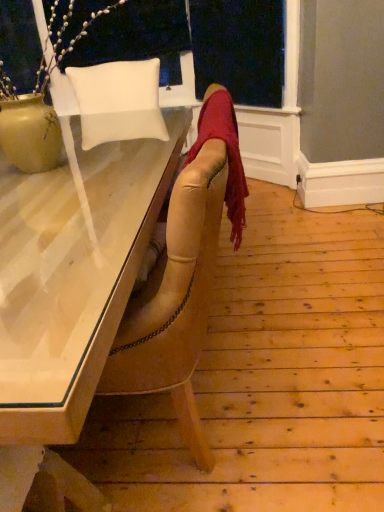
What is the approximate width of transparent glass window screen at upper center?

The width of transparent glass window screen at upper center is 4.73 inches.

At what (x,y) coordinates should I click in order to perform the action: click on white leather pillow at upper left. Please return your answer as a coordinate pair (x, y). The image size is (384, 512). Looking at the image, I should click on (118, 101).

The height and width of the screenshot is (512, 384). What do you see at coordinates (38, 105) in the screenshot?
I see `matte ceramic vase at upper left` at bounding box center [38, 105].

Where is `velvet red scarf at center`? The width and height of the screenshot is (384, 512). velvet red scarf at center is located at coordinates (227, 154).

Is matte ceramic vase at upper left touching velvet red scarf at center?

No, matte ceramic vase at upper left is not in contact with velvet red scarf at center.

The width and height of the screenshot is (384, 512). What are the coordinates of `blanket behind the matte ceramic vase at upper left` in the screenshot? It's located at (227, 154).

How far apart are matte ceramic vase at upper left and velvet red scarf at center?

matte ceramic vase at upper left and velvet red scarf at center are 73.46 centimeters apart.

Does matte ceramic vase at upper left turn towards velvet red scarf at center?

No, matte ceramic vase at upper left is not turned towards velvet red scarf at center.

Is point (30, 319) positioned behind point (216, 53)?

No, (30, 319) is closer to viewer.

Is matte white desk at center wider or thinner than transparent glass window screen at upper center?

Clearly, matte white desk at center has more width compared to transparent glass window screen at upper center.

Is matte white desk at center positioned far away from transparent glass window screen at upper center?

Yes, matte white desk at center and transparent glass window screen at upper center are quite far apart.

From a real-world perspective, who is located higher, matte white desk at center or transparent glass window screen at upper center?

In real-world perspective, transparent glass window screen at upper center is above.

Consider the image. How different are the orientations of matte white desk at center and velvet red scarf at center in degrees?

91.8 degrees.

Which of these two, matte white desk at center or velvet red scarf at center, stands taller?

matte white desk at center.

From the image's perspective, is matte white desk at center located above velvet red scarf at center?

No, from the image's perspective, matte white desk at center is not above velvet red scarf at center.

Does matte white desk at center have a lesser width compared to velvet red scarf at center?

No.

Based on the photo, from the image's perspective, relative to white leather pillow at upper left, is matte white desk at center above or below?

matte white desk at center is situated lower than white leather pillow at upper left in the image.

Is matte white desk at center outside of white leather pillow at upper left?

That's correct, matte white desk at center is outside of white leather pillow at upper left.

Considering the positions of objects matte white desk at center and white leather pillow at upper left in the image provided, who is behind, matte white desk at center or white leather pillow at upper left?

white leather pillow at upper left is further away from the camera.

Considering the sizes of objects matte ceramic vase at upper left and white leather pillow at upper left in the image provided, who is wider, matte ceramic vase at upper left or white leather pillow at upper left?

matte ceramic vase at upper left.

Is white leather pillow at upper left at the back of matte ceramic vase at upper left?

Correct, matte ceramic vase at upper left is looking away from white leather pillow at upper left.

Which is more to the right, matte ceramic vase at upper left or white leather pillow at upper left?

white leather pillow at upper left.

From a real-world perspective, between matte ceramic vase at upper left and white leather pillow at upper left, who is vertically higher?

matte ceramic vase at upper left.

Which object is further away from the camera, white leather pillow at upper left or transparent glass window screen at upper center?

Positioned behind is transparent glass window screen at upper center.

This screenshot has height=512, width=384. Identify the location of window screen above the white leather pillow at upper left (from a real-world perspective). (239, 49).

Can you confirm if white leather pillow at upper left is positioned to the right of transparent glass window screen at upper center?

Incorrect, white leather pillow at upper left is not on the right side of transparent glass window screen at upper center.

From a real-world perspective, is velvet red scarf at center physically located above or below matte white desk at center?

velvet red scarf at center is above matte white desk at center.

Is velvet red scarf at center spatially inside matte white desk at center, or outside of it?

velvet red scarf at center lies outside matte white desk at center.

Can you confirm if velvet red scarf at center is shorter than matte white desk at center?

Yes.

From the image's perspective, is velvet red scarf at center below matte white desk at center?

No.

You are a GUI agent. You are given a task and a screenshot of the screen. Output one action in this format:
    pyautogui.click(x=<x>, y=<y>)
    Task: Click on the houseplant in front of the velvet red scarf at center
    The width and height of the screenshot is (384, 512).
    Given the screenshot: What is the action you would take?
    pyautogui.click(x=38, y=105)

Find the location of a particular element. desk that appears below the transparent glass window screen at upper center (from the image's perspective) is located at coordinates (69, 295).

Looking at the image, which one is located closer to white leather pillow at upper left, matte white desk at center or matte ceramic vase at upper left?

matte ceramic vase at upper left lies closer to white leather pillow at upper left than the other object.

Based on their spatial positions, is matte white desk at center or velvet red scarf at center closer to transparent glass window screen at upper center?

Among the two, velvet red scarf at center is located nearer to transparent glass window screen at upper center.

From the image, which object appears to be farther from matte white desk at center, velvet red scarf at center or matte ceramic vase at upper left?

matte ceramic vase at upper left.

Which object lies further to the anchor point velvet red scarf at center, matte white desk at center or white leather pillow at upper left?

white leather pillow at upper left is further to velvet red scarf at center.

When comparing their distances from white leather pillow at upper left, does matte white desk at center or velvet red scarf at center seem further?

velvet red scarf at center is further to white leather pillow at upper left.

Estimate the real-world distances between objects in this image. Which object is closer to transparent glass window screen at upper center, velvet red scarf at center or white leather pillow at upper left?

white leather pillow at upper left is closer to transparent glass window screen at upper center.

Based on their spatial positions, is matte ceramic vase at upper left or white leather pillow at upper left closer to velvet red scarf at center?

matte ceramic vase at upper left lies closer to velvet red scarf at center than the other object.

Considering their positions, is white leather pillow at upper left positioned closer to matte white desk at center than velvet red scarf at center?

velvet red scarf at center is closer to matte white desk at center.

Image resolution: width=384 pixels, height=512 pixels. I want to click on houseplant situated between matte white desk at center and velvet red scarf at center from left to right, so click(x=38, y=105).

Locate an element on the screen. The width and height of the screenshot is (384, 512). blanket between matte ceramic vase at upper left and transparent glass window screen at upper center from front to back is located at coordinates (227, 154).

I want to click on pillow located between velvet red scarf at center and transparent glass window screen at upper center in the depth direction, so click(118, 101).

Where is `houseplant between matte white desk at center and white leather pillow at upper left along the z-axis`? houseplant between matte white desk at center and white leather pillow at upper left along the z-axis is located at coordinates (38, 105).